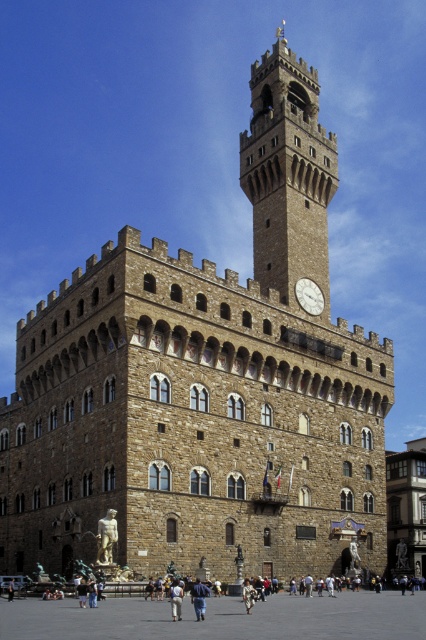
Question: Which of these objects is positioned farthest from the light brown leather jacket at center?

Choices:
 (A) white fabric bag at lower center
 (B) blue denim jeans at center
 (C) stone clock tower at upper center
 (D) smooth stone pavement at center

Answer: (C)

Question: Where is stone clock tower at upper center located in relation to light brown leather jacket at center in the image?

Choices:
 (A) below
 (B) above

Answer: (B)

Question: Based on their relative distances, which object is farther from the light brown leather jacket at center?

Choices:
 (A) smooth stone pavement at center
 (B) blue denim jeans at center
 (C) white fabric bag at lower center
 (D) white stone clock at center

Answer: (D)

Question: Can you confirm if bronze statue at center is thinner than white fabric bag at lower center?

Choices:
 (A) no
 (B) yes

Answer: (B)

Question: Does bronze statue at center have a smaller size compared to white fabric bag at lower center?

Choices:
 (A) no
 (B) yes

Answer: (B)

Question: Among these points, which one is farthest from the camera?

Choices:
 (A) (100, 531)
 (B) (244, 182)
 (C) (175, 596)

Answer: (B)